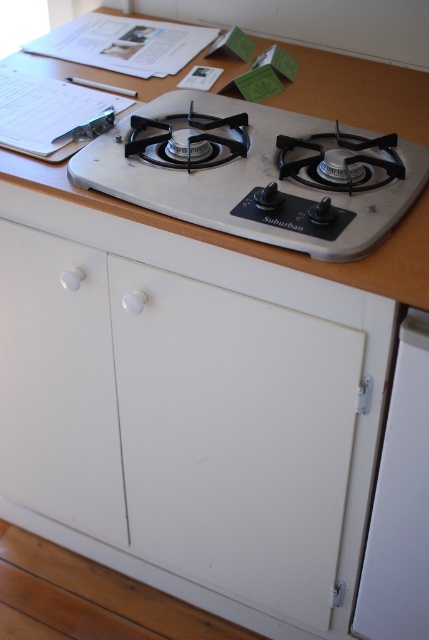
You are a chef trying to locate the control knob for the left burner on a white plastic gas stove at center. The stove has a white plastic knob at lower left. Based on their sizes, which object would you interact with to adjust the burner?

The white plastic knob at lower left is smaller than the white plastic gas stove at center, so you would interact with the white plastic knob at lower left to adjust the burner since it is the control knob.

Looking at this image, you are trying to reach the white plastic knob at lower left to turn on the stove. However, there is a wooden table at upper center in the way. Can you still access the knob without moving the table?

The wooden table at upper center is positioned over the white plastic knob at lower left, so you cannot access the knob without moving the table.

You are a technician trying to locate the control knob for the left burner on the Suburban stove. The stove has two burners with their respective control knobs. Given that the white plastic knob at center is one of them, can you determine which burner it controls based on its position?

The white plastic knob at center controls the left burner because it is positioned at the center, which is closer to the left burner than the right one.